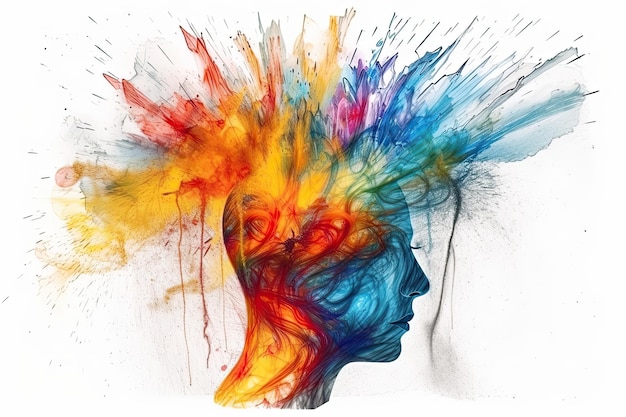
Where is `painting`? Image resolution: width=626 pixels, height=417 pixels. painting is located at coordinates (332, 166).